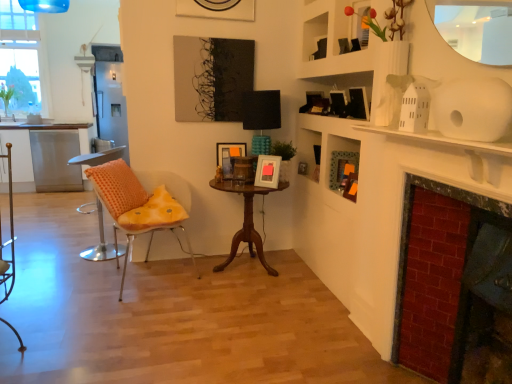
Identify the location of vacant space situated above red brick fireplace at right (from a real-world perspective). (450, 148).